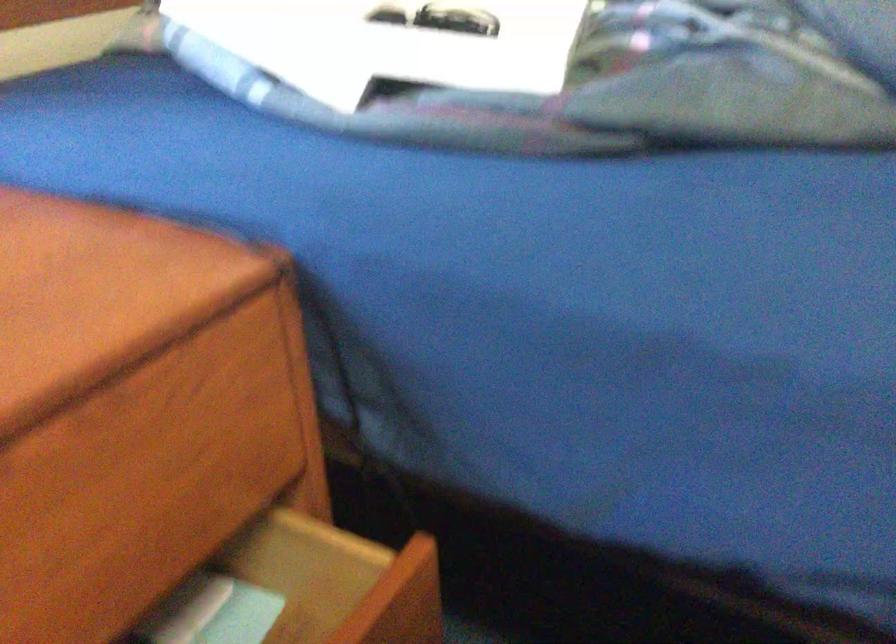
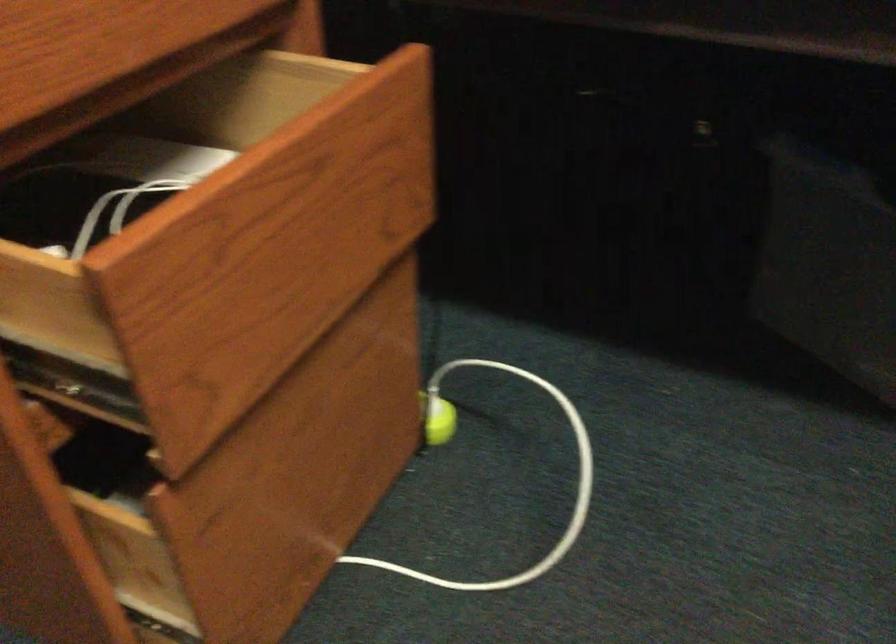
What movement of the cameraman would produce the second image?

The movement direction of the cameraman is left, backward.